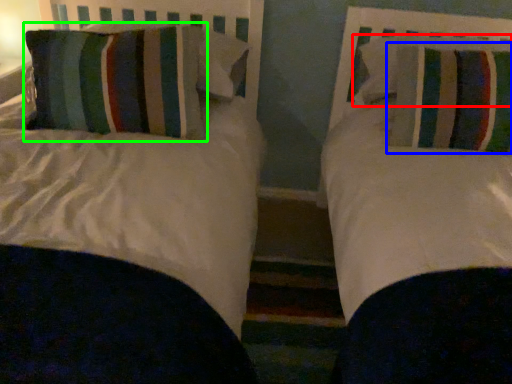
Question: Estimate the real-world distances between objects in this image. Which object is farther from pillow (highlighted by a red box), pillow (highlighted by a blue box) or pillow (highlighted by a green box)?

Choices:
 (A) pillow
 (B) pillow

Answer: (B)